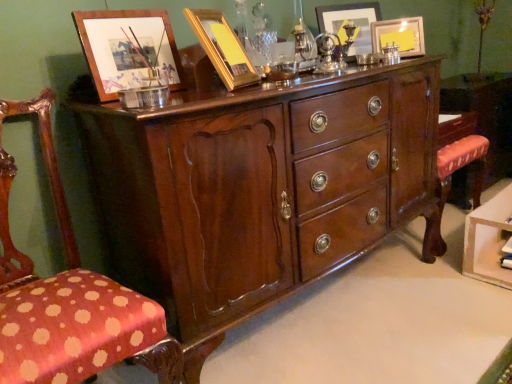
Question: Is the surface of shiny brown wood chest of drawers at center in direct contact with gold metallic picture frame at upper center, acting as the 3th picture frame starting from the back?

Choices:
 (A) no
 (B) yes

Answer: (A)

Question: Is shiny brown wood chest of drawers at center not close to gold metallic picture frame at upper center, acting as the 3th picture frame starting from the back?

Choices:
 (A) yes
 (B) no

Answer: (B)

Question: Is shiny brown wood chest of drawers at center bigger than gold metallic picture frame at upper center, acting as the 3th picture frame starting from the back?

Choices:
 (A) no
 (B) yes

Answer: (B)

Question: Does shiny brown wood chest of drawers at center turn towards gold metallic picture frame at upper center, arranged as the 2th picture frame when viewed from the left?

Choices:
 (A) yes
 (B) no

Answer: (B)

Question: Is shiny brown wood chest of drawers at center to the left of gold metallic picture frame at upper center, which is the second picture frame in front-to-back order, from the viewer's perspective?

Choices:
 (A) no
 (B) yes

Answer: (A)

Question: In terms of height, does mahogany wood vanity at right look taller or shorter compared to matte gold picture frame at upper right, placed as the 4th picture frame when sorted from left to right?

Choices:
 (A) tall
 (B) short

Answer: (A)

Question: From a real-world perspective, is mahogany wood vanity at right physically located above or below matte gold picture frame at upper right, placed as the 4th picture frame when sorted from left to right?

Choices:
 (A) below
 (B) above

Answer: (A)

Question: Is mahogany wood vanity at right to the left or to the right of matte gold picture frame at upper right, which is the second picture frame from back to front, in the image?

Choices:
 (A) right
 (B) left

Answer: (A)

Question: From the image's perspective, is mahogany wood vanity at right above or below matte gold picture frame at upper right, placed as the 4th picture frame when sorted from left to right?

Choices:
 (A) above
 (B) below

Answer: (B)

Question: Considering the positions of shiny brown wood chest of drawers at center and matte gold picture frame at upper center, the fourth picture frame in the front-to-back sequence, in the image, is shiny brown wood chest of drawers at center bigger or smaller than matte gold picture frame at upper center, the fourth picture frame in the front-to-back sequence,?

Choices:
 (A) small
 (B) big

Answer: (B)

Question: Is point (248, 271) closer or farther from the camera than point (366, 11)?

Choices:
 (A) closer
 (B) farther

Answer: (A)

Question: Is shiny brown wood chest of drawers at center inside or outside of matte gold picture frame at upper center, arranged as the 1th picture frame when viewed from the back?

Choices:
 (A) outside
 (B) inside

Answer: (A)

Question: From a real-world perspective, is shiny brown wood chest of drawers at center physically located above or below matte gold picture frame at upper center, the 3th picture frame from the left?

Choices:
 (A) above
 (B) below

Answer: (B)

Question: Based on their sizes in the image, would you say polka dot fabric chair at left is bigger or smaller than matte gold picture frame at upper center, the fourth picture frame in the front-to-back sequence?

Choices:
 (A) small
 (B) big

Answer: (B)

Question: From a real-world perspective, is polka dot fabric chair at left above or below matte gold picture frame at upper center, the 3th picture frame from the left?

Choices:
 (A) below
 (B) above

Answer: (A)